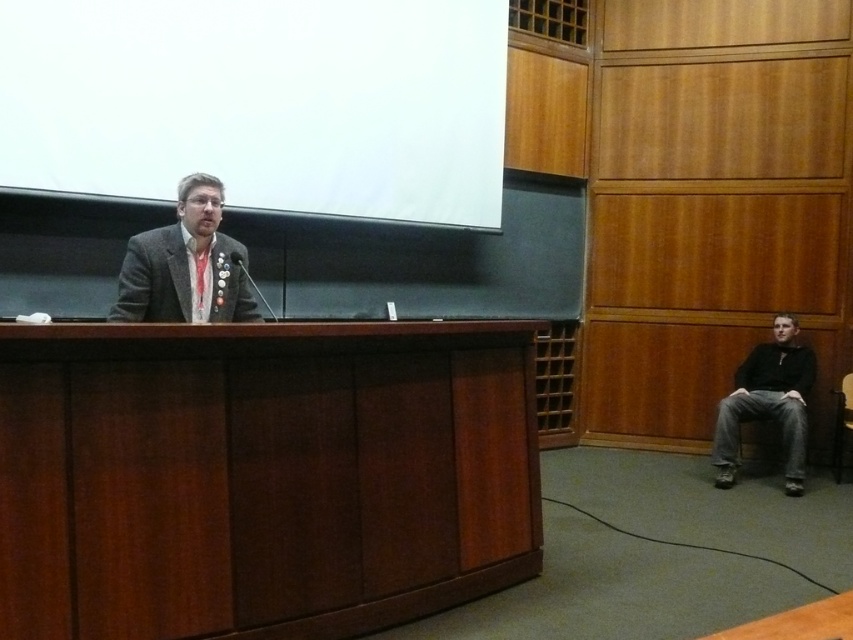
You are an event planner setting up for a presentation. You need to ensure that the white matte projection screen at upper center is visible to all attendees. Considering the wooden chair at right, which object should be placed closer to the audience to ensure visibility?

The white matte projection screen at upper center should be placed closer to the audience because it has a larger size compared to the wooden chair at right, making it more important for visibility during the presentation.

You are an event organizer and need to place a 2m long banner stand in the lecture hall. The banner stand requires 3 meters of space in front to be visible to all attendees. Based on the scene, is there enough space in front of the brown wood table at center to accommodate this requirement?

The position of brown wood table at center is at point (260, 476), but without knowing the dimensions of the room or the distance from the table to the back of the hall, it is impossible to determine if there is sufficient space for the banner stand requiring 3 meters in front. Additional measurements are needed.